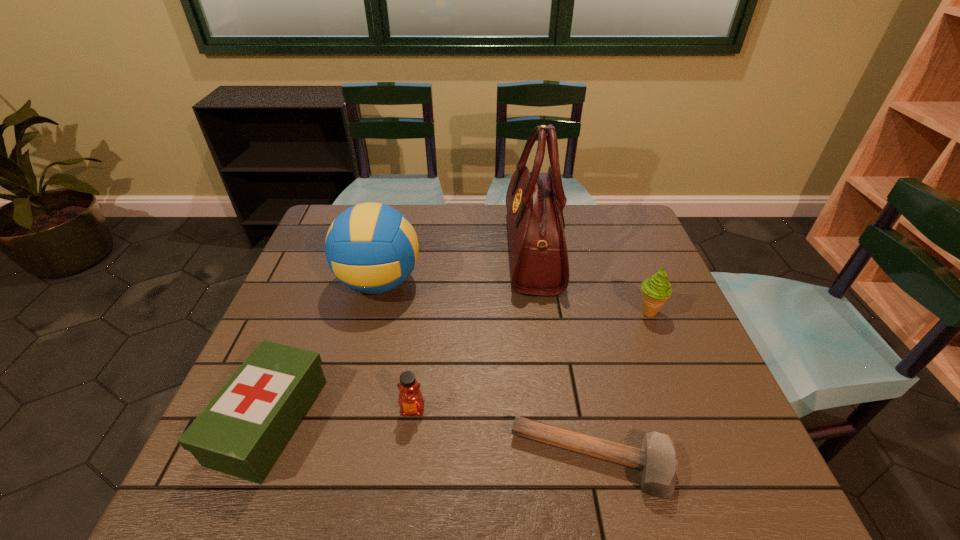
The height and width of the screenshot is (540, 960). I want to click on blank area in the image that satisfies the following two spatial constraints: 1. on the front side of the volleyball; 2. on the left side of the shortest object, so click(333, 460).

Identify the location of vacant space that satisfies the following two spatial constraints: 1. on the front-facing side of the handbag; 2. on the left side of the mallet. (564, 460).